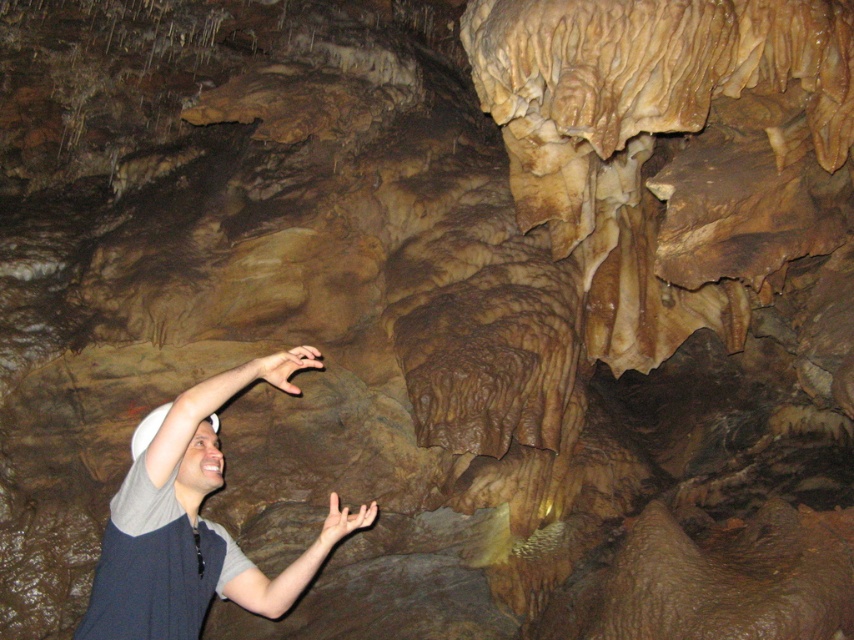
Question: Is gray fabric shirt at lower left thinner than matte brown hand at lower center?

Choices:
 (A) yes
 (B) no

Answer: (B)

Question: Estimate the real-world distances between objects in this image. Which object is farther from the pink flesh at center?

Choices:
 (A) matte brown hand at lower center
 (B) gray fabric shirt at lower left

Answer: (A)

Question: Is gray fabric shirt at lower left below pink flesh at center?

Choices:
 (A) yes
 (B) no

Answer: (A)

Question: Estimate the real-world distances between objects in this image. Which object is closer to the matte brown hand at lower center?

Choices:
 (A) gray fabric shirt at lower left
 (B) pink flesh at center

Answer: (A)

Question: Among these points, which one is farthest from the camera?

Choices:
 (A) (104, 618)
 (B) (305, 358)

Answer: (B)

Question: Does pink flesh at center have a smaller size compared to matte brown hand at lower center?

Choices:
 (A) no
 (B) yes

Answer: (B)